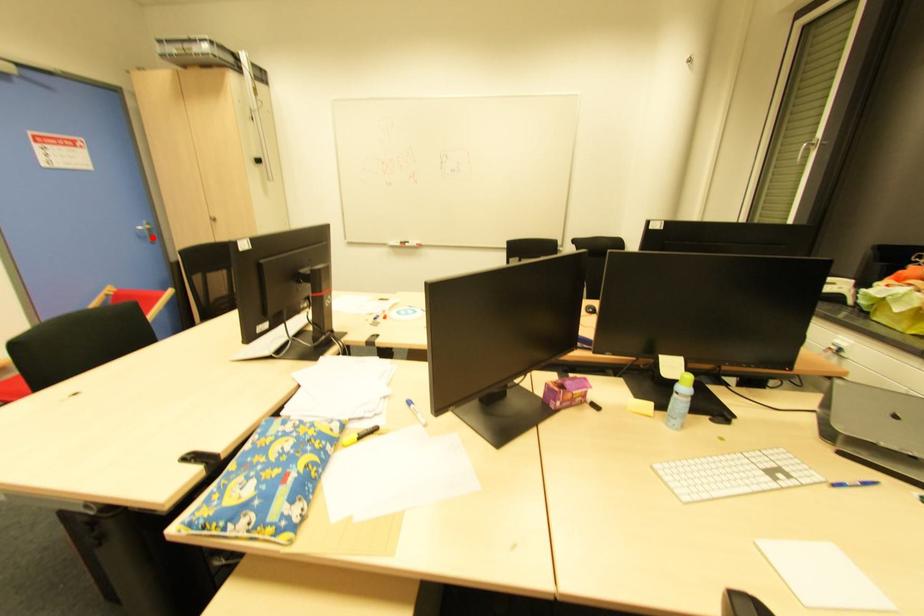
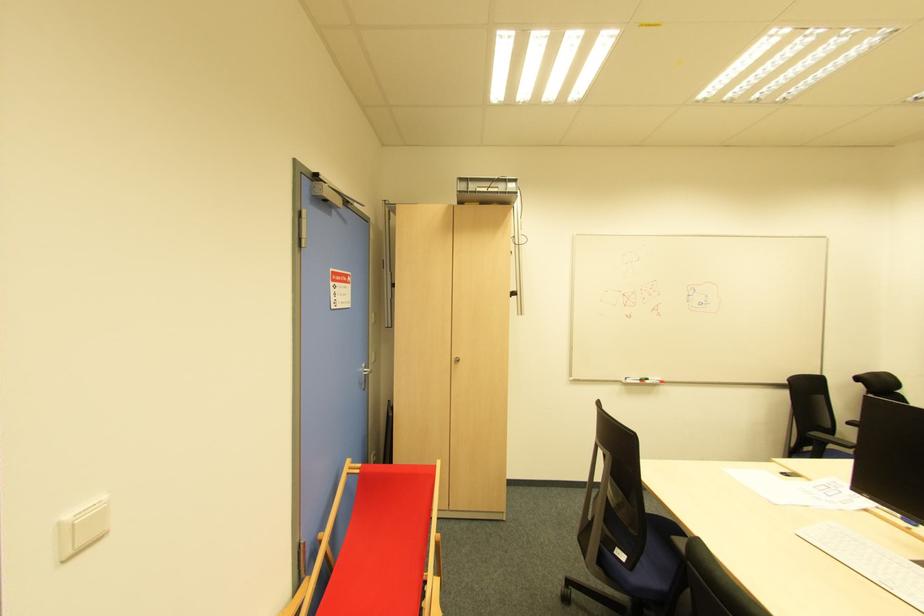
Locate, in the second image, the point that corresponds to the highlighted location in the first image.

(366, 382)